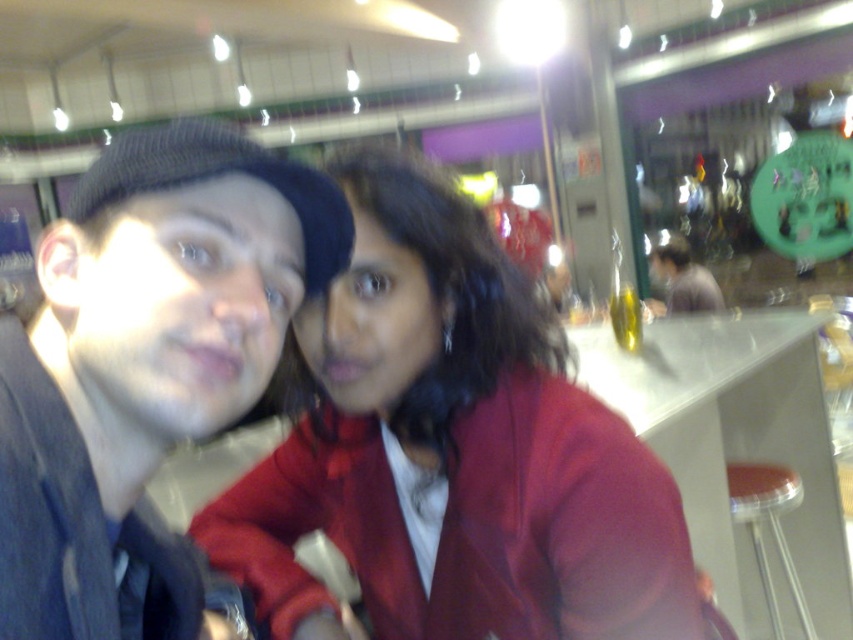
Does point (437, 195) come farther from viewer compared to point (711, 276)?

No, (437, 195) is closer to viewer.

Which is below, matte red jacket at center or matte gray shirt at center?

matte red jacket at center

Looking at this image, who is more distant from viewer, (277, 460) or (709, 276)?

The point (709, 276) is more distant.

Where is `matte red jacket at center`? matte red jacket at center is located at coordinates (453, 451).

Where is `matte red jacket at center`? The image size is (853, 640). matte red jacket at center is located at coordinates (453, 451).

Which is in front, point (445, 300) or point (115, 460)?

Point (115, 460) is more forward.

The image size is (853, 640). Find the location of `matte red jacket at center`. matte red jacket at center is located at coordinates (453, 451).

Who is positioned more to the left, matte red jacket at center or transparent plastic stool at lower right?

From the viewer's perspective, matte red jacket at center appears more on the left side.

I want to click on matte red jacket at center, so click(x=453, y=451).